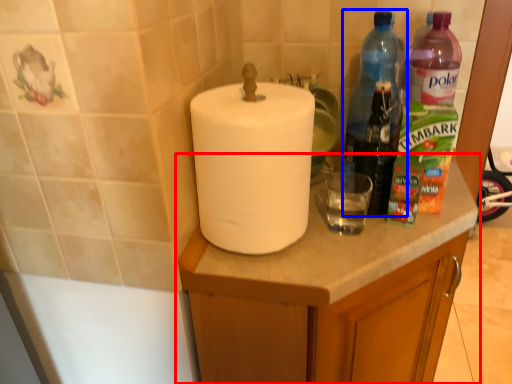
Question: Which of the following is the farthest to the observer, cabinetry (highlighted by a red box) or bottle (highlighted by a blue box)?

Choices:
 (A) cabinetry
 (B) bottle

Answer: (B)